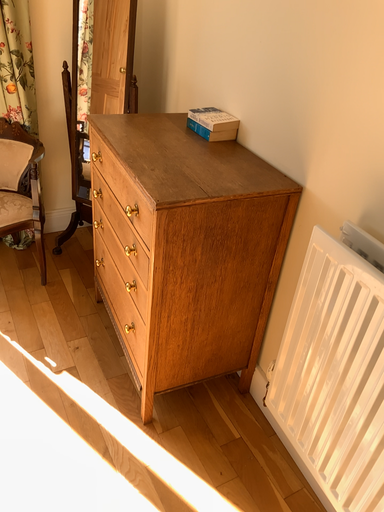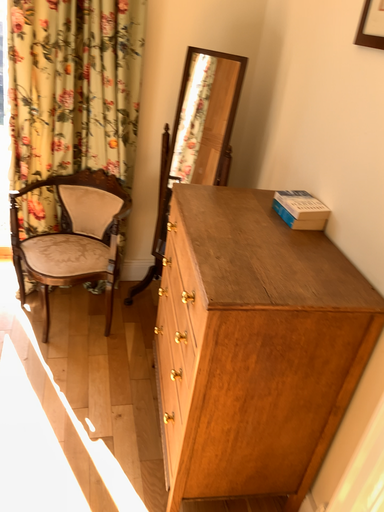
Question: Which way did the camera rotate in the video?

Choices:
 (A) rotated downward
 (B) rotated upward

Answer: (B)